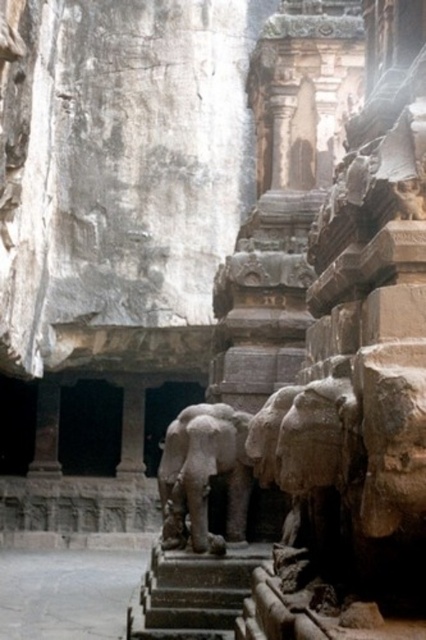
Question: Considering the relative positions of gray stone elephant at center and dark gray stone stairs at center in the image provided, where is gray stone elephant at center located with respect to dark gray stone stairs at center?

Choices:
 (A) left
 (B) right

Answer: (B)

Question: Is gray stone elephant at center smaller than dark gray stone stairs at center?

Choices:
 (A) yes
 (B) no

Answer: (A)

Question: Which of the following is the farthest from the observer?

Choices:
 (A) (164, 563)
 (B) (203, 476)

Answer: (B)

Question: Is gray stone elephant at center thinner than dark gray stone stairs at center?

Choices:
 (A) yes
 (B) no

Answer: (A)

Question: Which of the following is the farthest from the observer?

Choices:
 (A) dark gray stone stairs at center
 (B) gray stone elephant at center

Answer: (B)

Question: Which point is farther to the camera?

Choices:
 (A) (199, 541)
 (B) (224, 618)

Answer: (A)